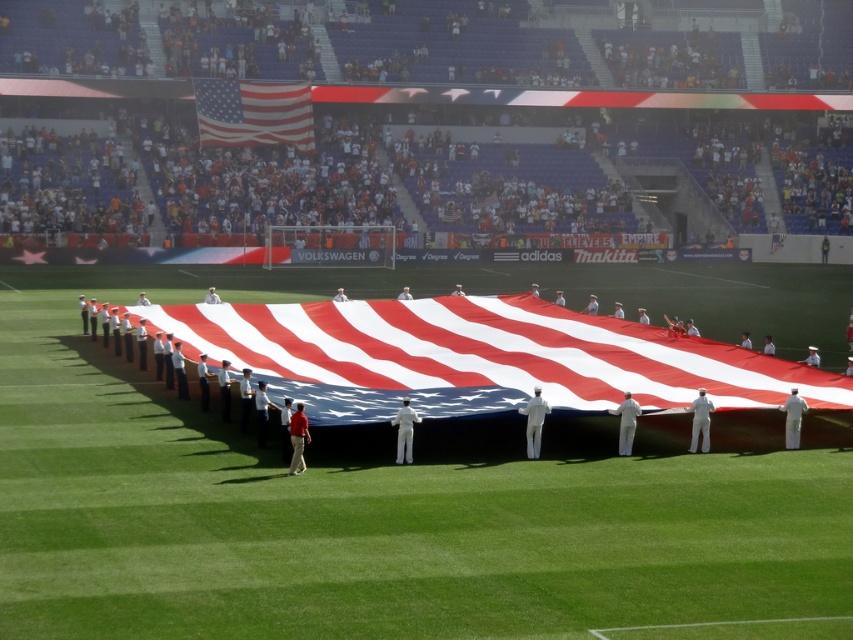
You are a photographer at the event and want to capture a photo that includes both the american flag at center and the matte fabric flag at upper center. Which flag should you position to the left in your camera frame to ensure both are visible?

To ensure both the american flag at center and the matte fabric flag at upper center are visible, position the matte fabric flag at upper center to the left in your camera frame since the american flag at center is on its right side.